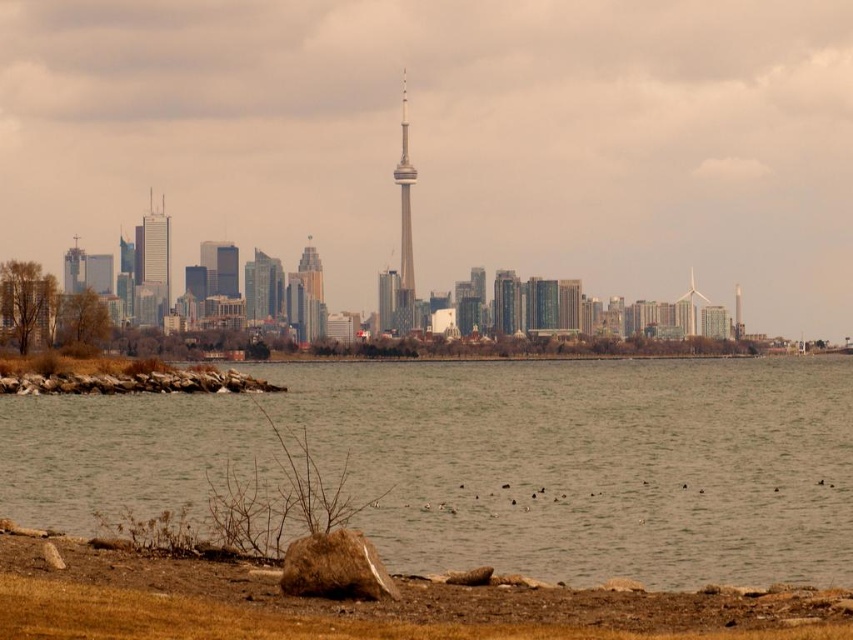
Which is behind, point (402, 86) or point (77, 278)?

The point (77, 278) is more distant.

Between point (403, 234) and point (82, 252), which one is positioned behind?

Point (82, 252)

Find the location of `smooth beige tower at center`. smooth beige tower at center is located at coordinates (405, 225).

Who is higher up, brown dirt at lower left or gold reflective glass skyscraper at center?

Positioned higher is gold reflective glass skyscraper at center.

Measure the distance between brown dirt at lower left and camera.

692.19 feet

This screenshot has width=853, height=640. In order to click on brown dirt at lower left in this screenshot , I will do `click(366, 605)`.

How far apart are brown water at lower center and matte glass skyscraper at left?

brown water at lower center and matte glass skyscraper at left are 136.41 meters apart.

Is brown water at lower center bigger than matte glass skyscraper at left?

Yes, brown water at lower center is bigger than matte glass skyscraper at left.

This screenshot has width=853, height=640. What do you see at coordinates (491, 461) in the screenshot? I see `brown water at lower center` at bounding box center [491, 461].

Where is `brown water at lower center`? The height and width of the screenshot is (640, 853). brown water at lower center is located at coordinates (491, 461).